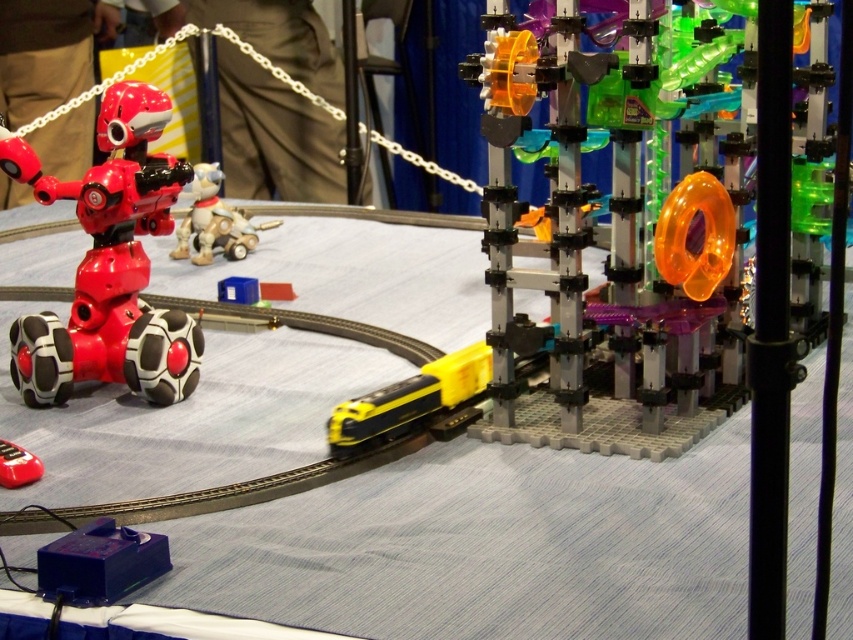
Question: Can you confirm if shiny red robot at left is thinner than plush white dog at center?

Choices:
 (A) yes
 (B) no

Answer: (B)

Question: Is translucent orange plastic gear at center closer to the viewer compared to plush white dog at center?

Choices:
 (A) no
 (B) yes

Answer: (B)

Question: Is translucent orange plastic gear at center above plush white dog at center?

Choices:
 (A) no
 (B) yes

Answer: (A)

Question: Among these objects, which one is farthest from the camera?

Choices:
 (A) shiny red remote control at lower left
 (B) plush white dog at center

Answer: (B)

Question: Which of the following is the farthest from the observer?

Choices:
 (A) (10, 468)
 (B) (207, 243)

Answer: (B)

Question: Which object is closer to the camera taking this photo?

Choices:
 (A) shiny red robot at left
 (B) translucent orange plastic gear at center
 (C) plush white dog at center

Answer: (B)